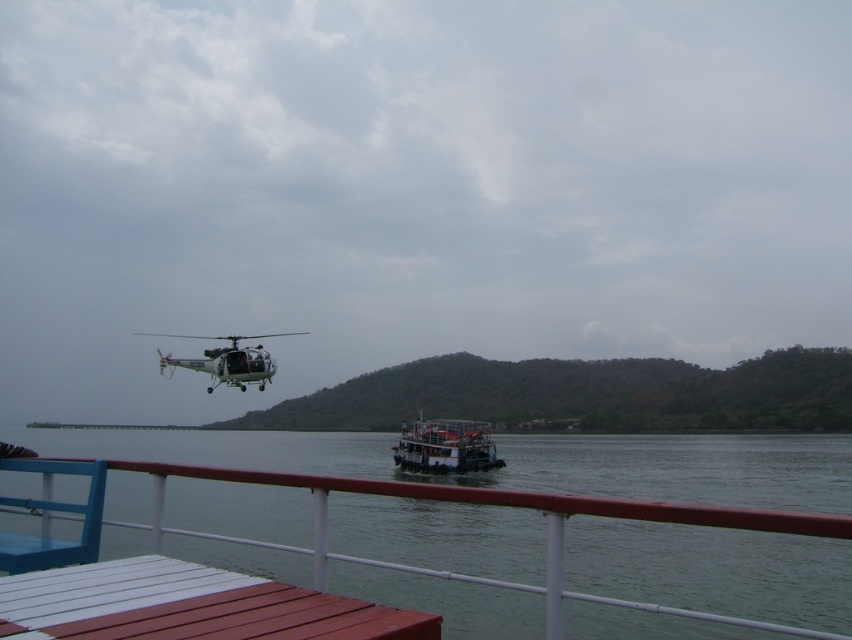
Which of these two, white matte boat at center or white matte helicopter at upper center, stands shorter?

Standing shorter between the two is white matte boat at center.

Who is higher up, white matte boat at center or white matte helicopter at upper center?

white matte helicopter at upper center is above.

Who is more forward, (419, 426) or (216, 381)?

Point (216, 381) is more forward.

Locate an element on the screen. white matte boat at center is located at coordinates (445, 445).

Between green water at lower center and white painted wood at lower center, which one is positioned lower?

green water at lower center is below.

Is green water at lower center thinner than white painted wood at lower center?

Incorrect, green water at lower center's width is not less than white painted wood at lower center's.

Which is behind, point (591, 540) or point (366, 604)?

The point (591, 540) is behind.

Identify the location of green water at lower center. This screenshot has height=640, width=852. (522, 461).

Between point (439, 618) and point (429, 429), which one is positioned behind?

Point (429, 429)

At what (x,y) coordinates should I click in order to perform the action: click on white painted wood at lower center. Please return your answer as a coordinate pair (x, y). This screenshot has width=852, height=640. Looking at the image, I should click on (188, 605).